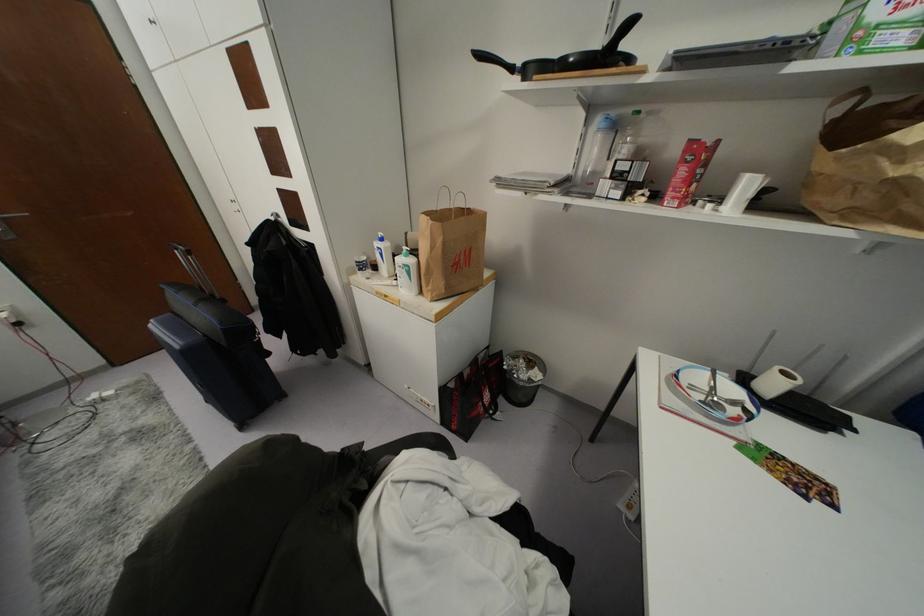
The image size is (924, 616). What do you see at coordinates (444, 197) in the screenshot?
I see `the paper bag handles` at bounding box center [444, 197].